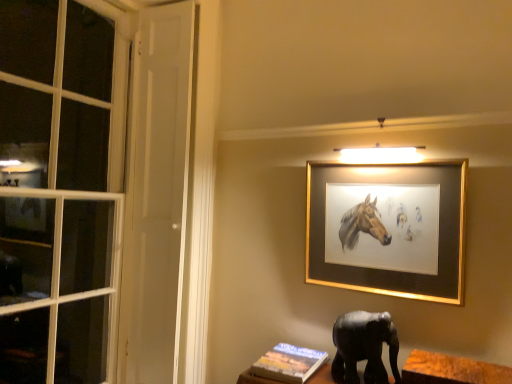
Question: Can you confirm if hardcover book at lower center is thinner than gold-framed painting at upper center?

Choices:
 (A) no
 (B) yes

Answer: (A)

Question: Does hardcover book at lower center turn towards gold-framed painting at upper center?

Choices:
 (A) yes
 (B) no

Answer: (B)

Question: From the image's perspective, is hardcover book at lower center above gold-framed painting at upper center?

Choices:
 (A) yes
 (B) no

Answer: (B)

Question: Is hardcover book at lower center positioned far away from gold-framed painting at upper center?

Choices:
 (A) no
 (B) yes

Answer: (A)

Question: Can you confirm if hardcover book at lower center is smaller than gold-framed painting at upper center?

Choices:
 (A) yes
 (B) no

Answer: (A)

Question: Does hardcover book at lower center have a lesser height compared to gold-framed painting at upper center?

Choices:
 (A) yes
 (B) no

Answer: (A)

Question: Does hardcover book at lower center have a lesser height compared to wooden at lower right?

Choices:
 (A) yes
 (B) no

Answer: (A)

Question: Are hardcover book at lower center and wooden at lower right far apart?

Choices:
 (A) yes
 (B) no

Answer: (B)

Question: Is hardcover book at lower center aimed at wooden at lower right?

Choices:
 (A) no
 (B) yes

Answer: (A)

Question: Is hardcover book at lower center with wooden at lower right?

Choices:
 (A) yes
 (B) no

Answer: (B)

Question: Considering the relative positions of hardcover book at lower center and wooden at lower right in the image provided, is hardcover book at lower center to the left of wooden at lower right from the viewer's perspective?

Choices:
 (A) no
 (B) yes

Answer: (B)

Question: Considering the relative sizes of hardcover book at lower center and wooden at lower right in the image provided, is hardcover book at lower center smaller than wooden at lower right?

Choices:
 (A) yes
 (B) no

Answer: (A)

Question: Is black matte elephant at lower right wider than gold-framed painting at upper center?

Choices:
 (A) no
 (B) yes

Answer: (B)